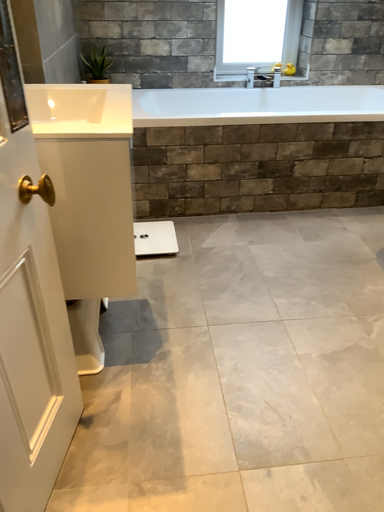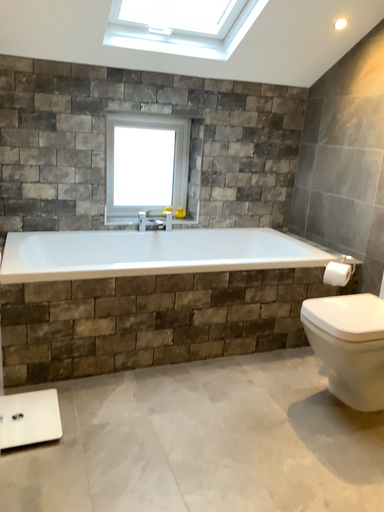
Question: Which way did the camera rotate in the video?

Choices:
 (A) rotated downward
 (B) rotated upward

Answer: (B)